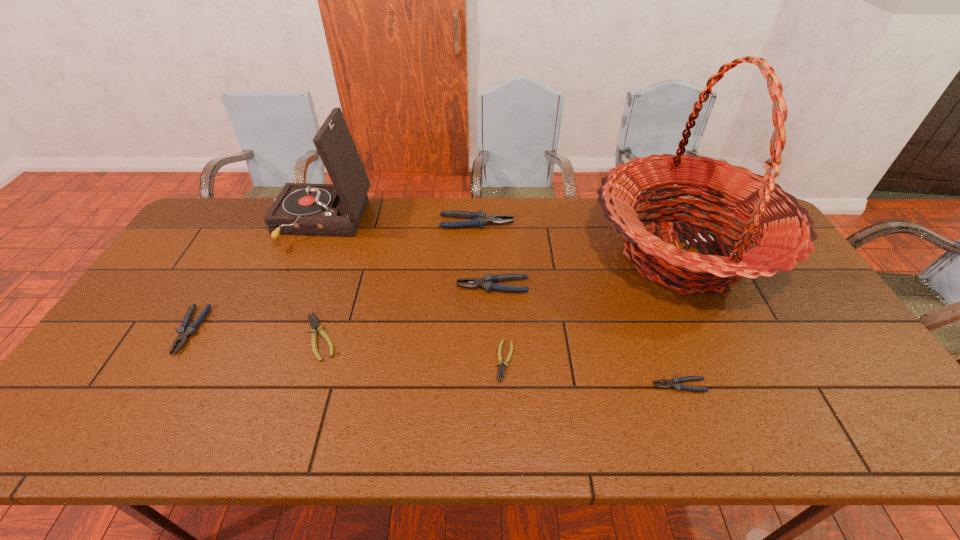
The height and width of the screenshot is (540, 960). In order to click on basket in this screenshot , I will do `click(783, 235)`.

Image resolution: width=960 pixels, height=540 pixels. I want to click on phonograph record, so click(309, 209).

Find the location of a particular element. Image resolution: width=960 pixels, height=540 pixels. the farthest gray pliers is located at coordinates (479, 219).

This screenshot has height=540, width=960. In order to click on the biggest gray pliers in this screenshot , I will do `click(479, 219)`.

Where is `the fourth tallest object`? This screenshot has height=540, width=960. the fourth tallest object is located at coordinates (487, 282).

This screenshot has width=960, height=540. I want to click on the second farthest pliers, so [487, 282].

Find the location of a particular element. This screenshot has width=960, height=540. the fourth shortest pliers is located at coordinates point(184,331).

Where is `the leftmost object`? the leftmost object is located at coordinates (184, 331).

This screenshot has width=960, height=540. In order to click on the smallest gray pliers in this screenshot , I will do `click(675, 383)`.

Identify the location of the rightmost gray pliers. Image resolution: width=960 pixels, height=540 pixels. (675, 383).